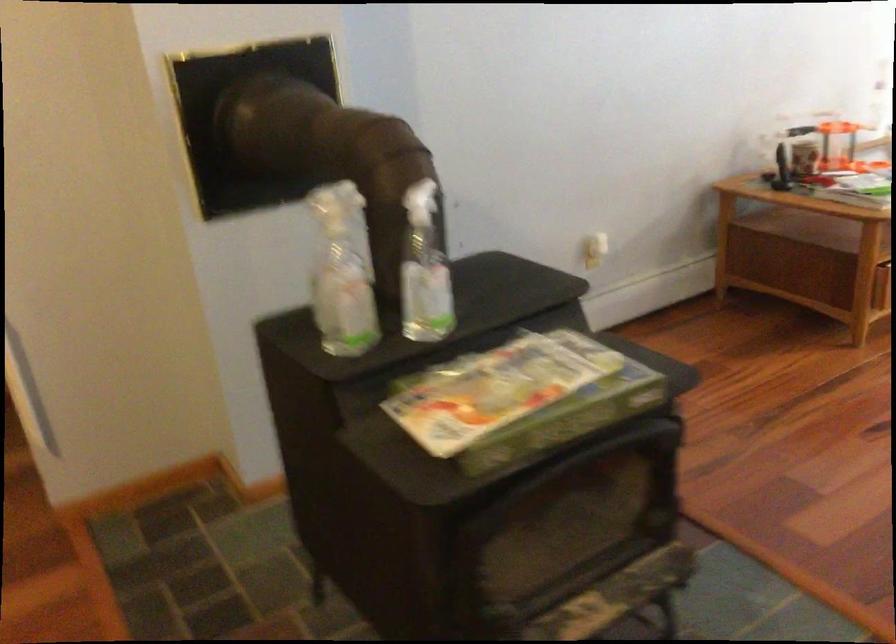
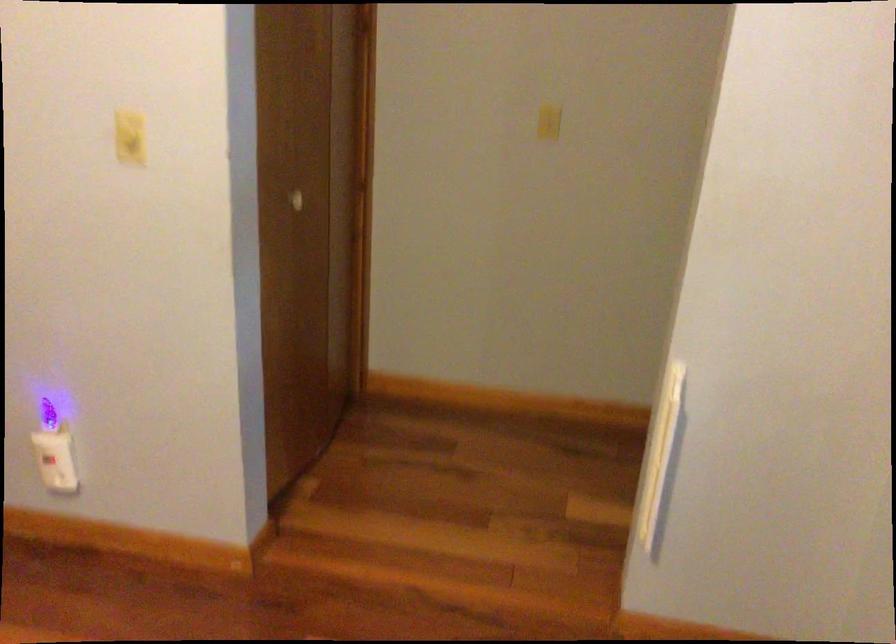
Question: The images are taken continuously from a first-person perspective. In which direction is your viewpoint rotating?

Choices:
 (A) Left
 (B) Right
 (C) Up
 (D) Down

Answer: (A)